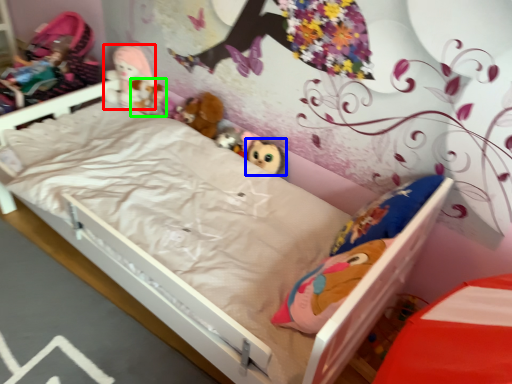
Question: Considering the real-world distances, which object is farthest from doll (highlighted by a red box)? toy (highlighted by a blue box) or toy (highlighted by a green box)?

Choices:
 (A) toy
 (B) toy

Answer: (A)